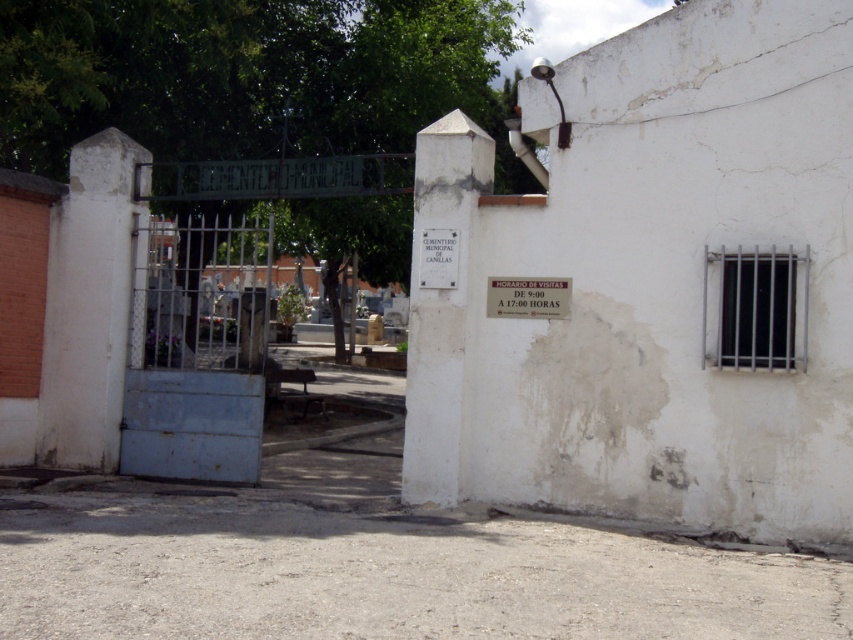
You are a visitor approaching the entrance of the cemetery. You need to check the visiting hours displayed on the white paper sign at upper center. However, you are standing at the rusty metal gate at center. Can you reach the sign to read it without moving closer?

The rusty metal gate at center and white paper sign at upper center are 5.68 meters apart from each other. Since the distance is more than an average person can read comfortably, you would need to move closer to read the white paper sign at upper center.

You are visiting the cemetery and need to check the visiting hours. The rusty metal gate at center is blocking your view. Can you see the white paper sign at upper center from where you are standing?

The rusty metal gate at center has a larger size compared to white paper sign at upper center. Since the gate is partially open, you might still be able to see the sign if it is positioned above the gate. However, the gate could obstruct the view depending on its open angle and your position.